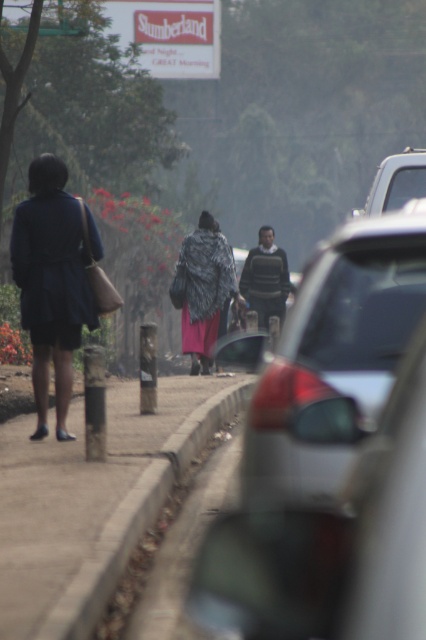
Question: Which point appears closest to the camera in this image?

Choices:
 (A) (14, 602)
 (B) (195, 305)
 (C) (95, 243)

Answer: (A)

Question: Can you confirm if concrete pavement at lower left is smaller than metallic silver truck at right?

Choices:
 (A) yes
 (B) no

Answer: (A)

Question: Which point is closer to the camera taking this photo?

Choices:
 (A) (288, 497)
 (B) (54, 218)
 (C) (52, 440)
 (D) (186, 298)

Answer: (A)

Question: Is metallic gray car at center bigger than fluffy black coat at center?

Choices:
 (A) no
 (B) yes

Answer: (B)

Question: Is matte blue dress at left positioned before metallic silver truck at right?

Choices:
 (A) no
 (B) yes

Answer: (B)

Question: Among these points, which one is farthest from the camera?

Choices:
 (A) (348, 264)
 (B) (43, 356)
 (C) (109, 410)
 (D) (201, 243)

Answer: (D)